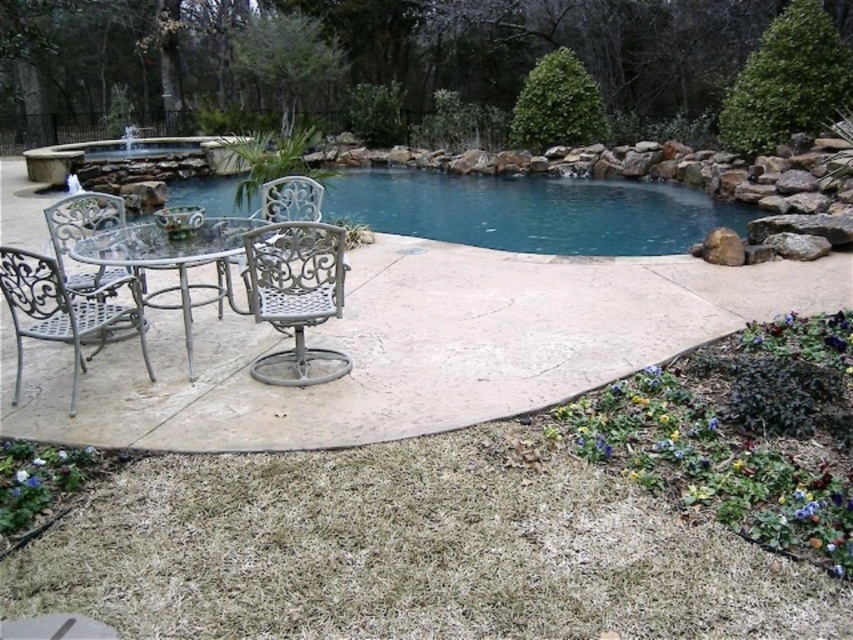
Question: Is clear glass pond at center behind metallic silver chair at left?

Choices:
 (A) yes
 (B) no

Answer: (A)

Question: Which of these objects is positioned closest to the metallic silver chair at left?

Choices:
 (A) metallic silver table at center
 (B) metallic silver chair at center
 (C) white wrought iron chair at center

Answer: (A)

Question: Which object is the closest to the silver wrought iron chair at lower left?

Choices:
 (A) clear glass pond at center
 (B) metallic silver table at center
 (C) white wrought iron chair at center

Answer: (B)

Question: In this image, where is clear glass pond at center located relative to metallic silver chair at center?

Choices:
 (A) above
 (B) below

Answer: (A)

Question: Is silver wrought iron chair at lower left smaller than metallic silver table at center?

Choices:
 (A) no
 (B) yes

Answer: (B)

Question: Estimate the real-world distances between objects in this image. Which object is closer to the clear glass pond at center?

Choices:
 (A) metallic silver chair at left
 (B) metallic silver table at center

Answer: (B)